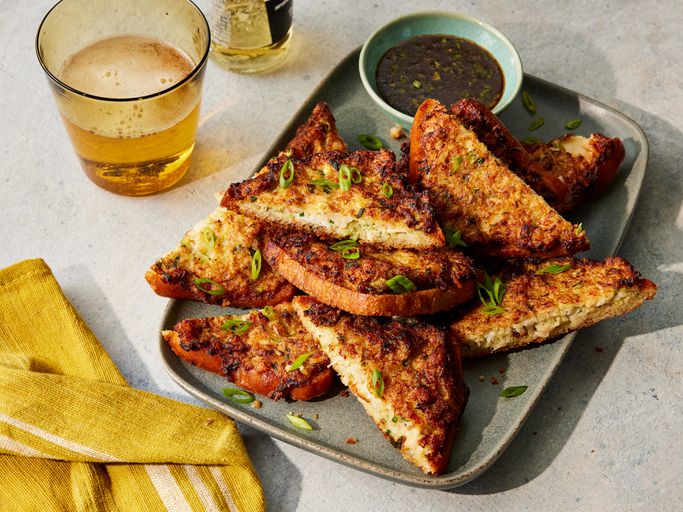
The image size is (683, 512). I want to click on glass of possibly beer, so pyautogui.click(x=133, y=108).